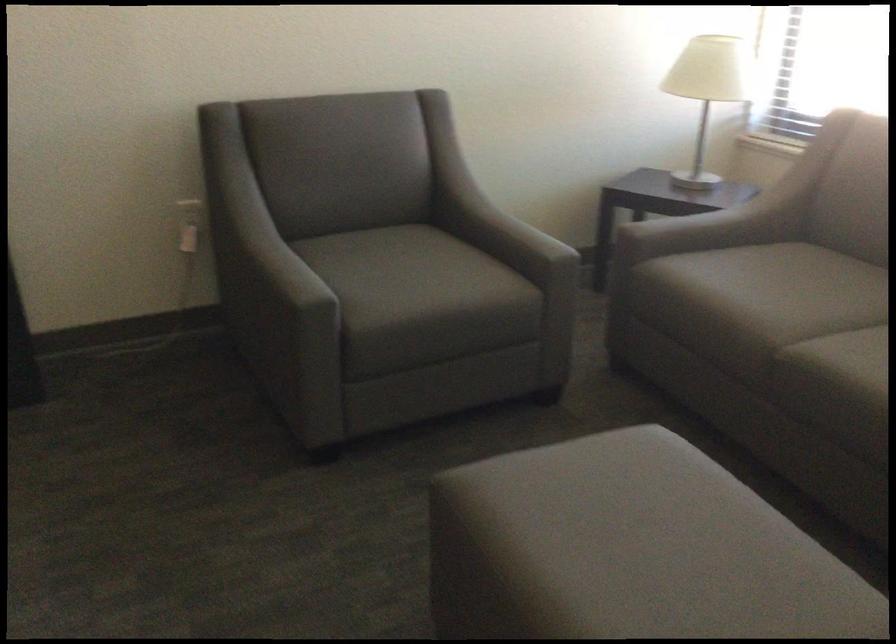
Find the location of `white electrical outlet`. white electrical outlet is located at coordinates (188, 225).